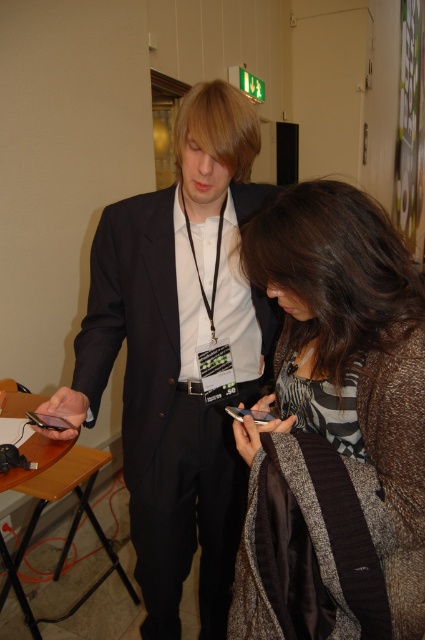
Question: Based on their relative distances, which object is nearer to the black matte suit at center?

Choices:
 (A) matte black smartphone at center
 (B) striped fabric shirt at center

Answer: (B)

Question: Is black matte suit at center bigger than matte black smartphone at center?

Choices:
 (A) no
 (B) yes

Answer: (B)

Question: Does black matte suit at center appear on the left side of matte black smartphone at center?

Choices:
 (A) no
 (B) yes

Answer: (B)

Question: Which of the following is the farthest from the observer?

Choices:
 (A) (342, 268)
 (B) (104, 211)

Answer: (B)

Question: Which object appears farthest from the camera in this image?

Choices:
 (A) matte black smartphone at center
 (B) striped fabric shirt at center
 (C) black matte suit at center

Answer: (C)

Question: Can you confirm if striped fabric shirt at center is wider than black matte suit at center?

Choices:
 (A) yes
 (B) no

Answer: (B)